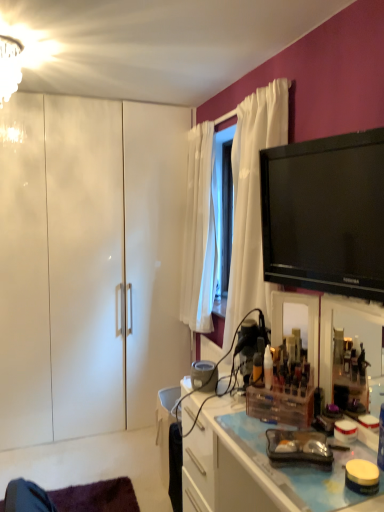
Question: Do you think black glossy tv at upper right is within white glossy cabinet at left, the 2th cabinetry from the right, or outside of it?

Choices:
 (A) outside
 (B) inside

Answer: (A)

Question: Based on their sizes in the image, would you say black glossy tv at upper right is bigger or smaller than white glossy cabinet at left, the 2th cabinetry from the right?

Choices:
 (A) small
 (B) big

Answer: (A)

Question: Which object is the farthest from the white glass chandelier at upper left?

Choices:
 (A) clear plastic organizer at center, the first cabinetry when ordered from front to back
 (B) white glossy cabinet at left, acting as the 1th cabinetry starting from the back
 (C) black glossy tv at upper right

Answer: (A)

Question: Which object is the farthest from the black glossy tv at upper right?

Choices:
 (A) white glossy cabinet at left, acting as the 1th cabinetry starting from the back
 (B) clear plastic organizer at center, the first cabinetry when ordered from front to back
 (C) white glass chandelier at upper left

Answer: (A)